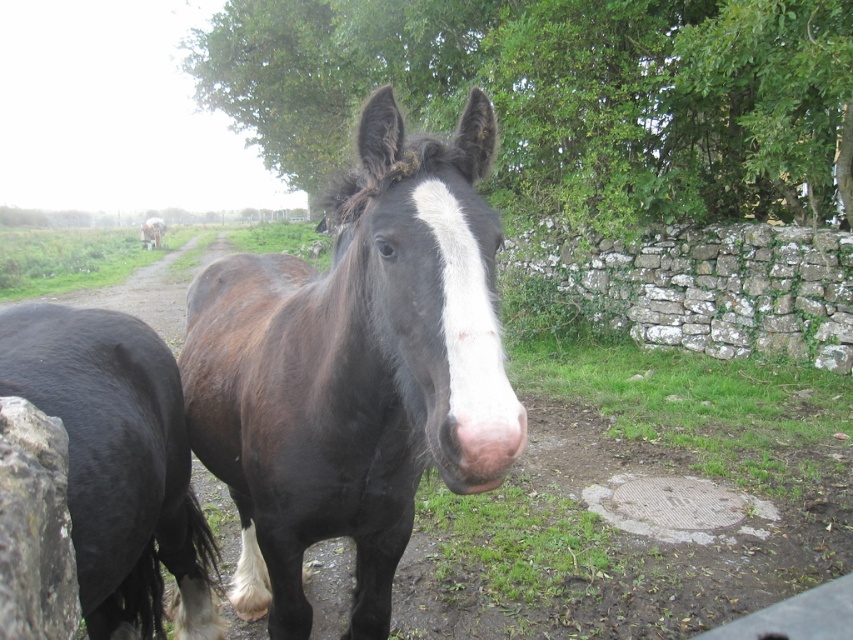
You are standing at the point marked as point (119, 465) in the image. Which object is directly in front of you?

The point (119, 465) corresponds to the black glossy horse at left, so the black glossy horse at left is directly in front of you.

You are standing at the point with coordinates point (x=157, y=246) and want to move towards the point with coordinates point (x=386, y=554). Which direction should you move to reach it?

You should move forward because point (x=386, y=554) is in front of point (x=157, y=246).